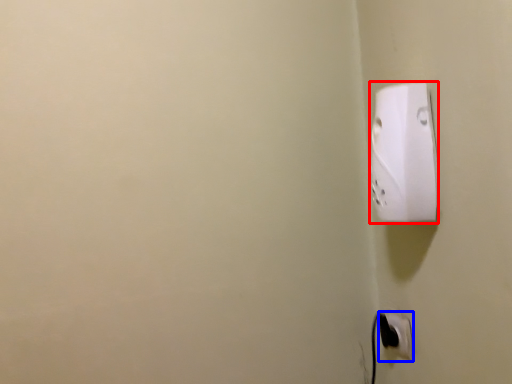
Question: Among these objects, which one is farthest to the camera, power plugs and sockets (highlighted by a red box) or power plugs and sockets (highlighted by a blue box)?

Choices:
 (A) power plugs and sockets
 (B) power plugs and sockets

Answer: (B)